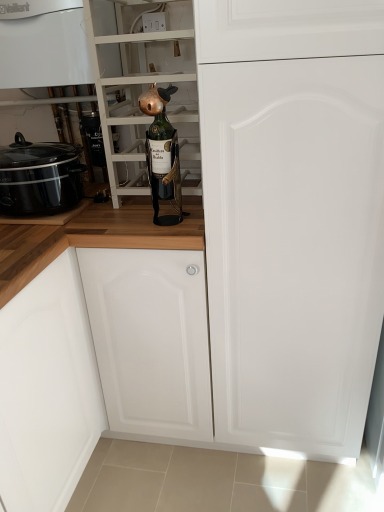
The height and width of the screenshot is (512, 384). Find the location of `vacant region in front of green glass bottle at center`. vacant region in front of green glass bottle at center is located at coordinates coord(142,222).